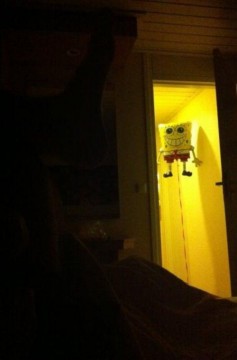
Image resolution: width=237 pixels, height=360 pixels. I want to click on upper wooden box on wall, so click(x=184, y=27).